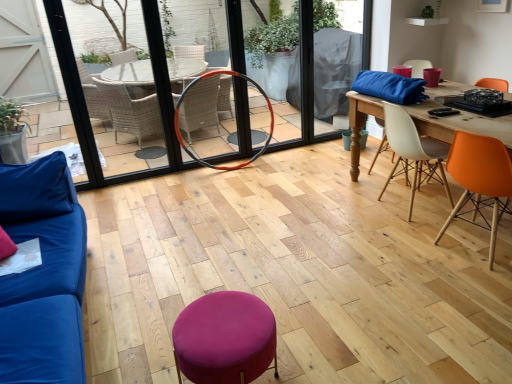
Question: Does purple fabric stool at center come behind orange rubber hula hoop at center?

Choices:
 (A) yes
 (B) no

Answer: (B)

Question: Would you say purple fabric stool at center contains orange rubber hula hoop at center?

Choices:
 (A) yes
 (B) no

Answer: (B)

Question: From the image's perspective, is purple fabric stool at center beneath orange rubber hula hoop at center?

Choices:
 (A) yes
 (B) no

Answer: (A)

Question: From a real-world perspective, does purple fabric stool at center stand above orange rubber hula hoop at center?

Choices:
 (A) yes
 (B) no

Answer: (B)

Question: Is purple fabric stool at center to the right of orange rubber hula hoop at center from the viewer's perspective?

Choices:
 (A) no
 (B) yes

Answer: (B)

Question: Does purple fabric stool at center have a greater width compared to orange rubber hula hoop at center?

Choices:
 (A) no
 (B) yes

Answer: (B)

Question: Is the position of orange rubber hula hoop at center less distant than that of white plastic chair at center right, acting as the 1th chair starting from the back?

Choices:
 (A) yes
 (B) no

Answer: (B)

Question: Is orange rubber hula hoop at center positioned beyond the bounds of white plastic chair at center right, acting as the 1th chair starting from the back?

Choices:
 (A) yes
 (B) no

Answer: (A)

Question: From the image's perspective, is orange rubber hula hoop at center located beneath white plastic chair at center right, the second chair when ordered from front to back?

Choices:
 (A) no
 (B) yes

Answer: (A)

Question: From the image's perspective, is orange rubber hula hoop at center on white plastic chair at center right, the second chair when ordered from front to back?

Choices:
 (A) no
 (B) yes

Answer: (B)

Question: Is orange rubber hula hoop at center smaller than white plastic chair at center right, the second chair when ordered from front to back?

Choices:
 (A) yes
 (B) no

Answer: (B)

Question: Would you say orange rubber hula hoop at center is a long distance from white plastic chair at center right, the second chair when ordered from front to back?

Choices:
 (A) no
 (B) yes

Answer: (B)

Question: Is orange matte chair at right, the first chair in the front-to-back sequence, thinner than blue fabric couch at left?

Choices:
 (A) yes
 (B) no

Answer: (A)